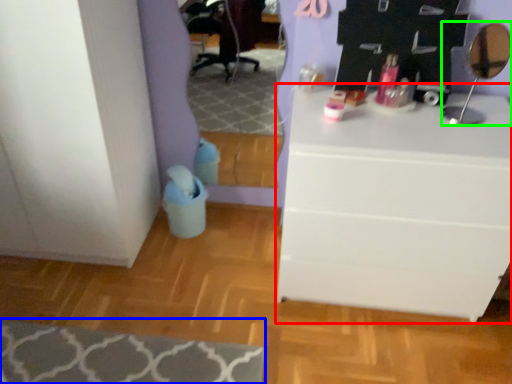
Question: Based on their relative distances, which object is nearer to chest of drawers (highlighted by a red box)? Choose from mat (highlighted by a blue box) and mirror (highlighted by a green box).

Choices:
 (A) mat
 (B) mirror

Answer: (B)